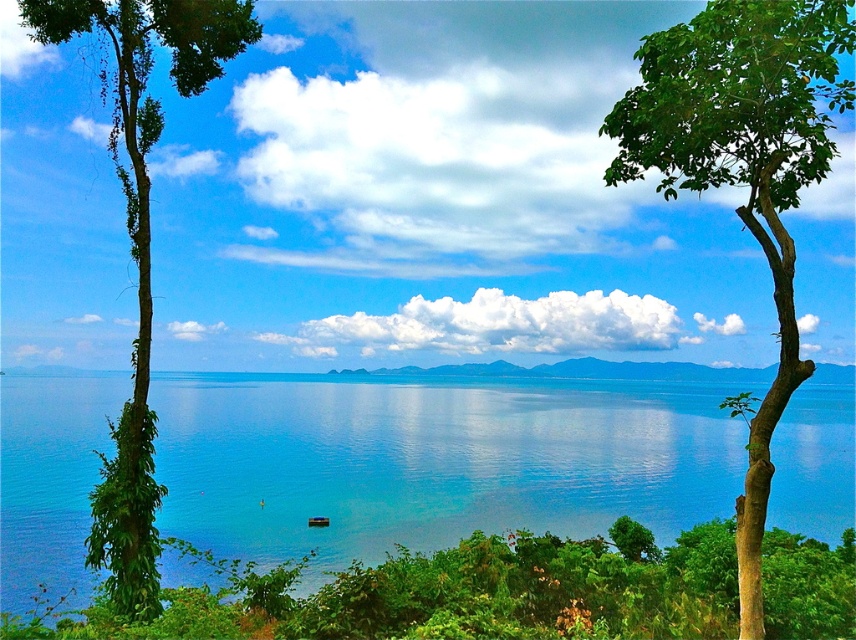
Question: Does green leafy tree at right have a lesser width compared to green leafy tree at left?

Choices:
 (A) no
 (B) yes

Answer: (A)

Question: Does green leafy tree at right appear under green leafy tree at left?

Choices:
 (A) no
 (B) yes

Answer: (B)

Question: Estimate the real-world distances between objects in this image. Which object is closer to the transparent blue water at center?

Choices:
 (A) green leafy tree at left
 (B) green leafy tree at right

Answer: (A)

Question: Does transparent blue water at center have a greater width compared to green leafy tree at left?

Choices:
 (A) no
 (B) yes

Answer: (B)

Question: Which point is closer to the camera?

Choices:
 (A) green leafy tree at left
 (B) transparent blue water at center

Answer: (A)

Question: Among these objects, which one is farthest from the camera?

Choices:
 (A) green leafy tree at right
 (B) green leafy tree at left

Answer: (B)